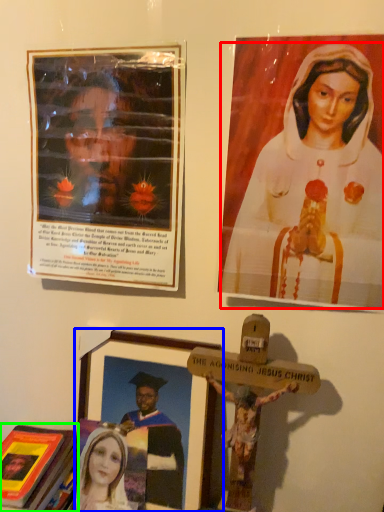
Question: Which object is the closest to the woman (highlighted by a red box)? Choose among these: picture frame (highlighted by a blue box) or book (highlighted by a green box).

Choices:
 (A) picture frame
 (B) book

Answer: (A)